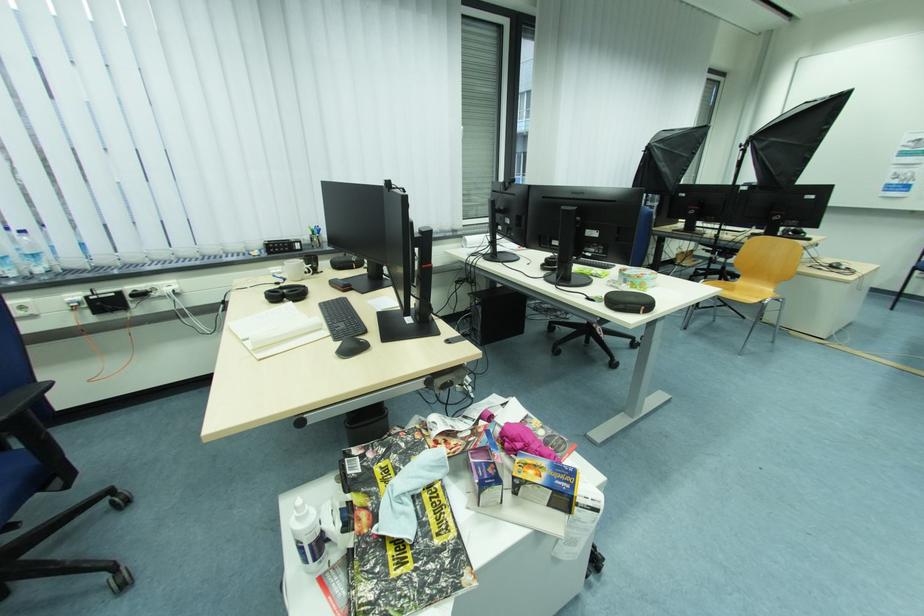
Where would you squeez the white spray bottle? Please return your answer as a coordinate pair (x, y).

(307, 536)